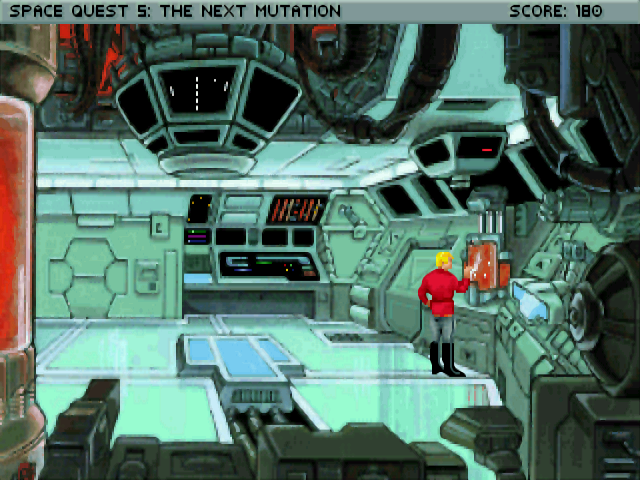
You are a GUI agent. You are given a task and a screenshot of the screen. Output one action in this format:
    pyautogui.click(x=<x>, y=<y>)
    Task: Click on the display
    The width and height of the screenshot is (640, 480).
    Given the screenshot: What is the action you would take?
    (x=475, y=154)